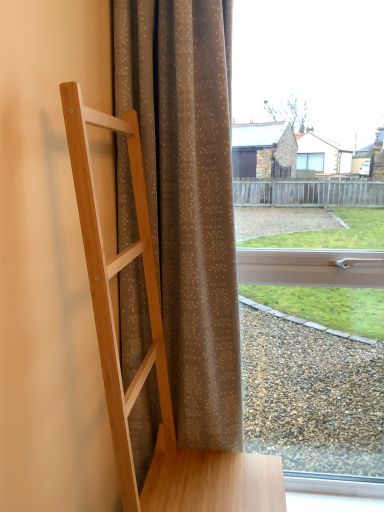
Measure the distance between point (163, 71) and camera.

3.59 feet.

Describe the element at coordinates (188, 199) in the screenshot. I see `brown sheer curtain at center` at that location.

Find the location of a particular element. natural wood ladder at left is located at coordinates (152, 356).

Is brown sheer curtain at center thinner than natural wood ladder at left?

Indeed, brown sheer curtain at center has a lesser width compared to natural wood ladder at left.

Is brown sheer curtain at center further to camera compared to natural wood ladder at left?

Yes, brown sheer curtain at center is behind natural wood ladder at left.

Do you think natural wood ladder at left is within transparent glass window at center, or outside of it?

natural wood ladder at left is located beyond the bounds of transparent glass window at center.

Which is farther, (151, 255) or (243, 375)?

The point (243, 375) is behind.

Which of these two, natural wood ladder at left or transparent glass window at center, is thinner?

transparent glass window at center.

Considering the sizes of objects natural wood ladder at left and transparent glass window at center in the image provided, who is smaller, natural wood ladder at left or transparent glass window at center?

transparent glass window at center is smaller.

The width and height of the screenshot is (384, 512). Identify the location of curtain in front of the transparent glass window at center. (188, 199).

Does point (151, 443) lie behind point (380, 431)?

No, it is not.

Is brown sheer curtain at center thinner than transparent glass window at center?

No, brown sheer curtain at center is not thinner than transparent glass window at center.

How many degrees apart are the facing directions of brown sheer curtain at center and transparent glass window at center?

The angular difference between brown sheer curtain at center and transparent glass window at center is 2.83 degrees.

From a real-world perspective, which object rests below the other?

natural wood ladder at left, from a real-world perspective.

Is the surface of transparent glass window at center in direct contact with natural wood ladder at left?

They are not placed beside each other.

The height and width of the screenshot is (512, 384). What are the coordinates of `furniture below the transparent glass window at center (from the image's perspective)` in the screenshot? It's located at (152, 356).

From the image's perspective, which object appears higher, transparent glass window at center or natural wood ladder at left?

transparent glass window at center is shown above in the image.

From the picture: Considering the sizes of objects natural wood ladder at left and brown sheer curtain at center in the image provided, who is bigger, natural wood ladder at left or brown sheer curtain at center?

Bigger between the two is natural wood ladder at left.

Which is closer, (97, 334) or (137, 86)?

The point (97, 334) is closer.

Identify the location of furniture in front of the brown sheer curtain at center. The width and height of the screenshot is (384, 512). (152, 356).

Does natural wood ladder at left have a lesser width compared to brown sheer curtain at center?

Incorrect, the width of natural wood ladder at left is not less than that of brown sheer curtain at center.

Considering the sizes of objects transparent glass window at center and brown sheer curtain at center in the image provided, who is taller, transparent glass window at center or brown sheer curtain at center?

transparent glass window at center is taller.

From a real-world perspective, is transparent glass window at center above or below brown sheer curtain at center?

In terms of real-world spatial position, transparent glass window at center is below brown sheer curtain at center.

Is transparent glass window at center completely or partially outside of brown sheer curtain at center?

transparent glass window at center lies outside brown sheer curtain at center's area.

Does point (369, 482) come farther from viewer compared to point (242, 433)?

No, (369, 482) is in front of (242, 433).

Find the location of `furniture below the brown sheer curtain at center (from the image's perspective)`. furniture below the brown sheer curtain at center (from the image's perspective) is located at coordinates (152, 356).

Locate an element on the screen. Image resolution: width=384 pixels, height=512 pixels. window above the natural wood ladder at left (from the image's perspective) is located at coordinates (314, 339).

In the scene shown: From the image, which object appears to be nearer to brown sheer curtain at center, transparent glass window at center or natural wood ladder at left?

natural wood ladder at left.

Based on their spatial positions, is brown sheer curtain at center or transparent glass window at center further from natural wood ladder at left?

The object further to natural wood ladder at left is transparent glass window at center.

Estimate the real-world distances between objects in this image. Which object is closer to transparent glass window at center, brown sheer curtain at center or natural wood ladder at left?

The object closer to transparent glass window at center is brown sheer curtain at center.

Based on their spatial positions, is natural wood ladder at left or transparent glass window at center closer to brown sheer curtain at center?

natural wood ladder at left is closer to brown sheer curtain at center.

Based on their spatial positions, is transparent glass window at center or brown sheer curtain at center closer to natural wood ladder at left?

brown sheer curtain at center.

Which object lies further to the anchor point transparent glass window at center, natural wood ladder at left or brown sheer curtain at center?

The object further to transparent glass window at center is natural wood ladder at left.

I want to click on curtain between natural wood ladder at left and transparent glass window at center in the front-back direction, so click(x=188, y=199).